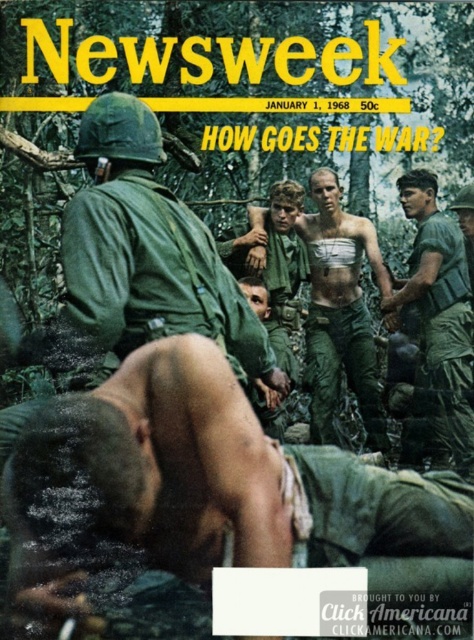
Who is higher up, matte green uniform at center or green matte helmet at upper left?

green matte helmet at upper left

Which of these two, matte green uniform at center or green matte helmet at upper left, stands shorter?

matte green uniform at center is shorter.

Does point (209, 465) come behind point (173, 292)?

No, it is in front of (173, 292).

Find the location of `matte green uniform at center`. matte green uniform at center is located at coordinates (201, 484).

Between green matte helmet at upper left and skinny man at center, which one has less height?

Standing shorter between the two is skinny man at center.

Which is behind, point (164, 253) or point (255, 266)?

The point (255, 266) is behind.

This screenshot has height=640, width=474. Identify the location of green matte helmet at upper left. (148, 250).

This screenshot has height=640, width=474. In order to click on green matte helmet at upper left in this screenshot , I will do `click(148, 250)`.

Is matte green uniform at center positioned before skinny man at center?

Yes, it is in front of skinny man at center.

Does matte green uniform at center have a greater height compared to skinny man at center?

No, matte green uniform at center is not taller than skinny man at center.

You are a GUI agent. You are given a task and a screenshot of the screen. Output one action in this format:
    pyautogui.click(x=<x>, y=<y>)
    Task: Click on the matte green uniform at center
    
    Given the screenshot: What is the action you would take?
    pyautogui.click(x=201, y=484)

Where is `matte green uniform at center`? Image resolution: width=474 pixels, height=640 pixels. matte green uniform at center is located at coordinates (201, 484).